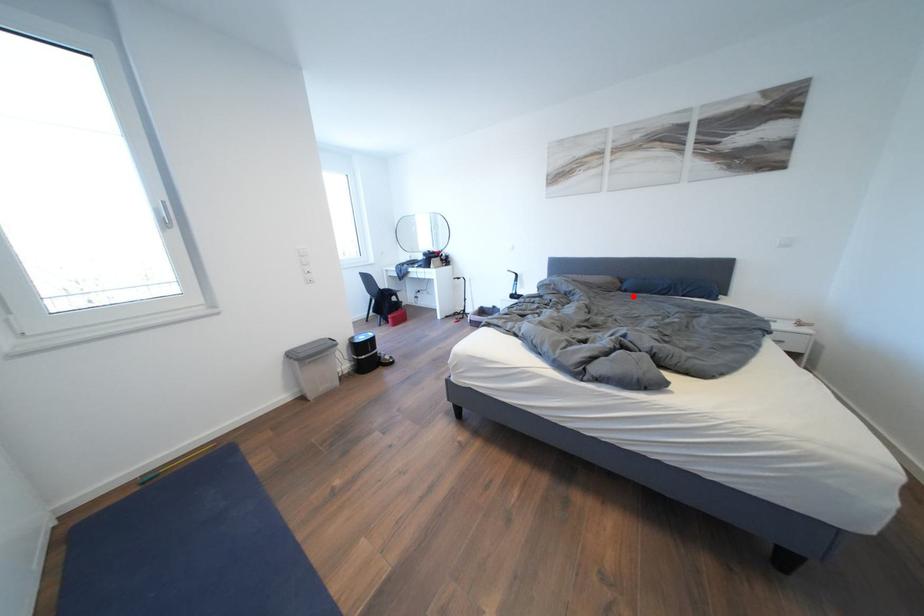
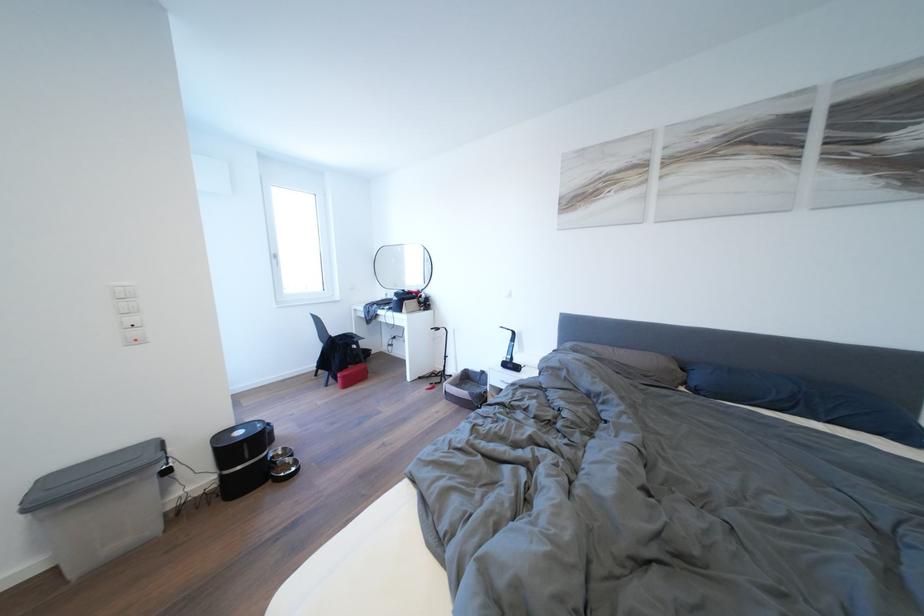
Find the pixel in the second image that matches the highlighted location in the first image.

(703, 395)